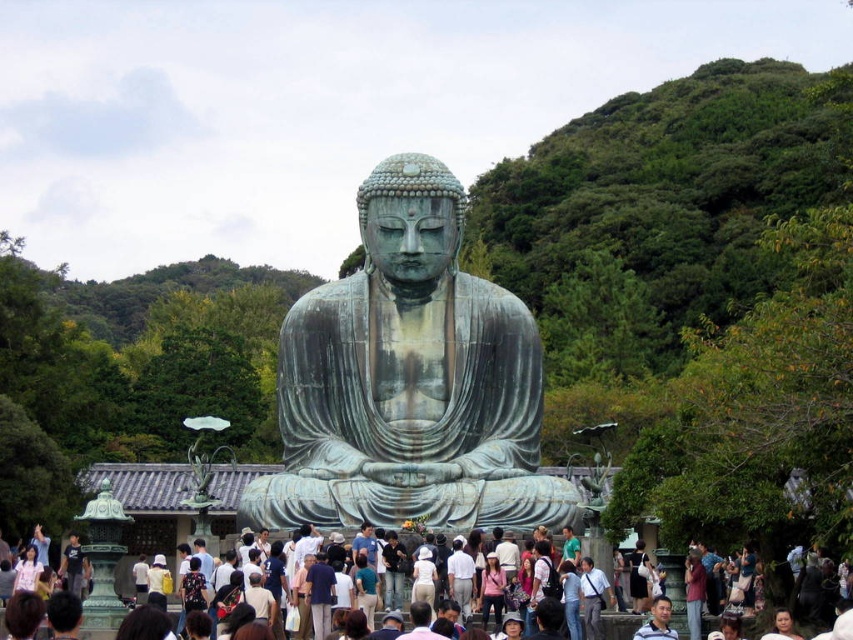
You are standing in front of the seated Buddha statue and want to determine which of the two points, point (x=695, y=618) or point (x=28, y=572), is closer to you. Based on the scene description, which point is nearer?

Point (x=695, y=618) is closer to the viewer than point (x=28, y=572).

You are a photographer standing at the entrance of the garden. You want to take a photo of the green patina bronze statue at center. What are the coordinates of the statue?

The green patina bronze statue at center is located at coordinates point (409, 380).